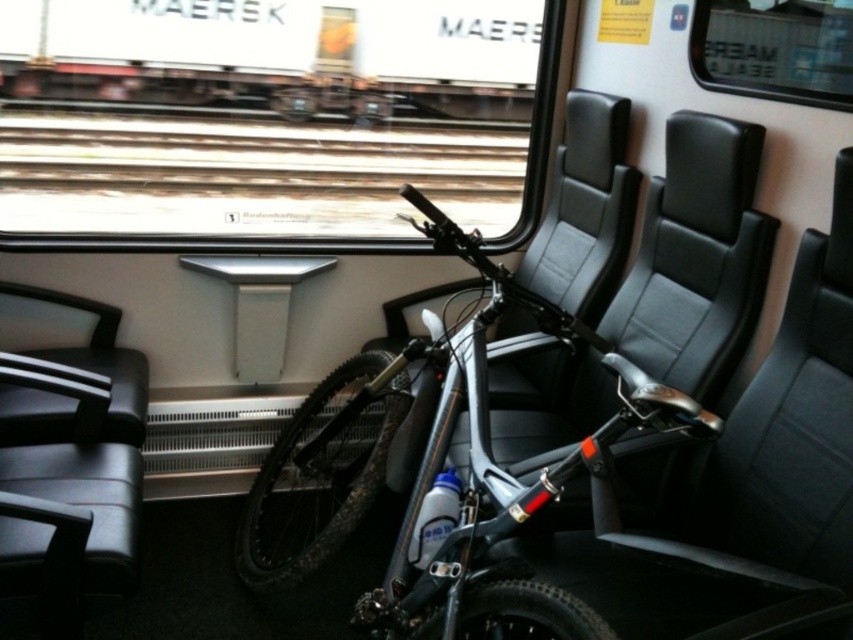
You are a passenger sitting in the black leather chair at left. You want to get up and move to the window to take a photo. Is the bicycle between your current seat and the window?

The black leather chair at left is located at point (68, 468). Since the bicycle is placed between two seats, and the chair is one of those seats, the bicycle is indeed between the black leather chair at left and the window. Therefore, the bicycle is in the way.

You are a passenger in the train carriage and want to place a backpack that is 1 meter long on the floor between the black leather chair at center and the bicycle. Is there enough space?

The black leather chair at center is 1.11 meters from the camera, so there is sufficient space to place a 1 meter long backpack between the black leather chair at center and the bicycle.

You are a passenger sitting in the black leather chair at left and want to reach the window to take a photo. The silver metallic bicycle at center is blocking your path. Can you easily walk around the bicycle to get to the window?

The silver metallic bicycle at center is further to the viewer than the black leather chair at left, meaning it is closer to you. Since the bicycle is blocking your path and positioned closer to you, you would need to navigate around it carefully. However, the exact feasibility depends on the space available between the bicycle and the carriage walls or adjacent seats, which isn